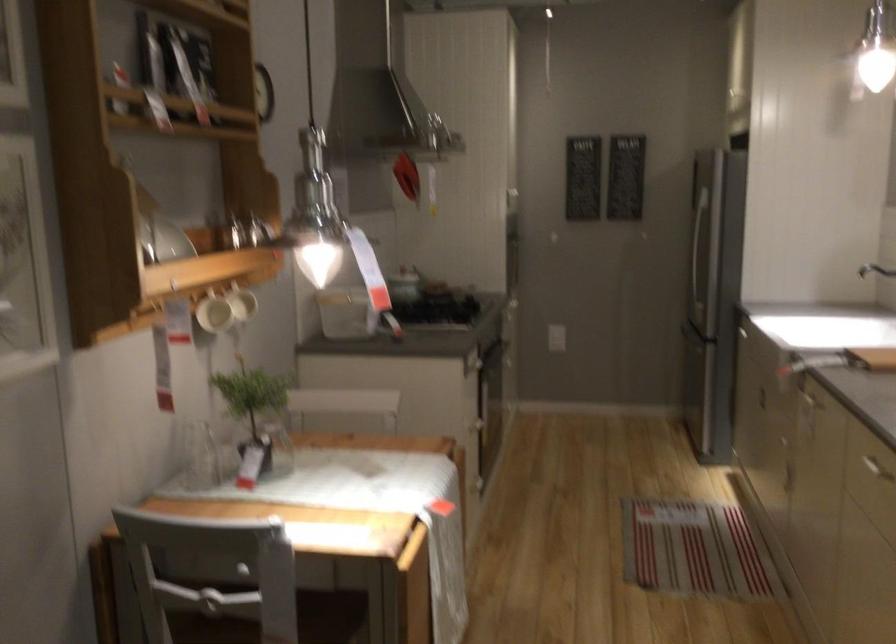
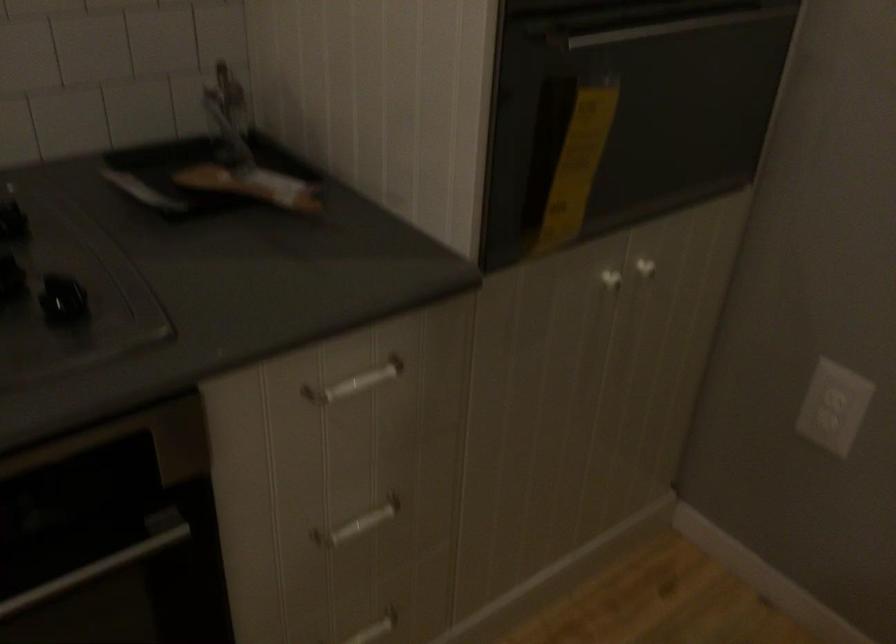
Where in the second image is the point corresponding to point (533, 287) from the first image?

(645, 268)